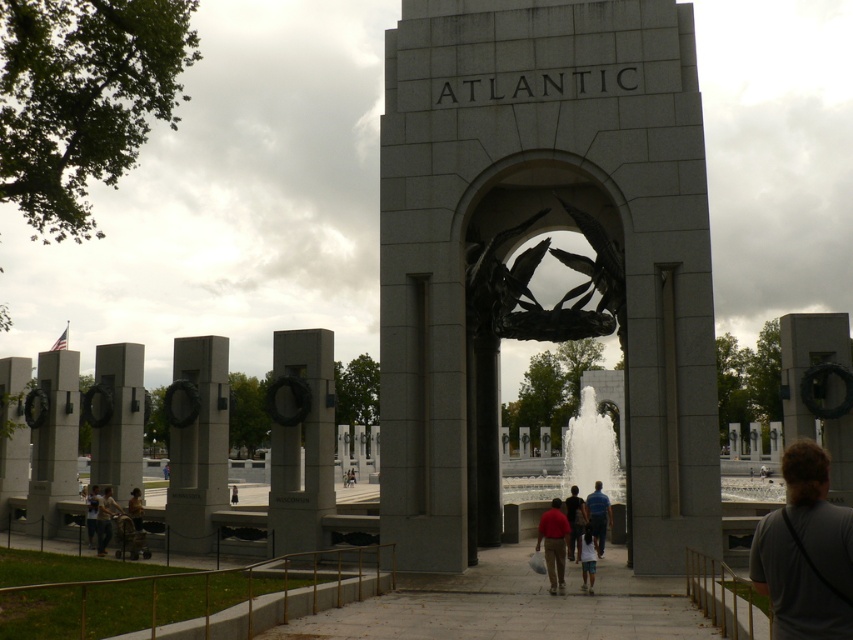
You are standing at the entrance of the Atlantic Theater Arch and want to locate the gray concrete wreath at left. According to the coordinates provided, where should you look relative to the arch?

The gray concrete wreath at left is located at point (53,442), which means it is positioned to the left side of the arch.

You are a visitor at the World War II Memorial and want to take a photo of the white marble fountain at center. However, there is a dark brown leather jacket at lower left in the way. Can you see the fountain clearly from your current position?

The white marble fountain at center is much taller than the dark brown leather jacket at lower left, so yes, you can see the fountain clearly over the jacket.